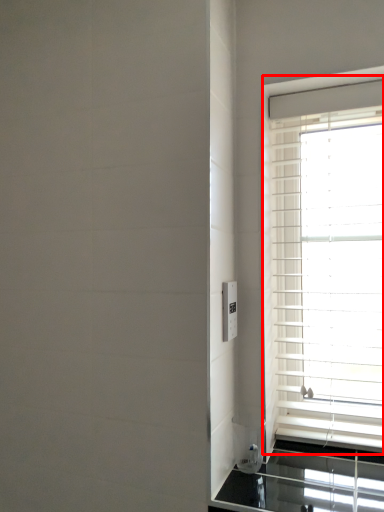
Question: From the image's perspective, where is window (annotated by the red box) located in relation to electric outlet in the image?

Choices:
 (A) above
 (B) below

Answer: (A)